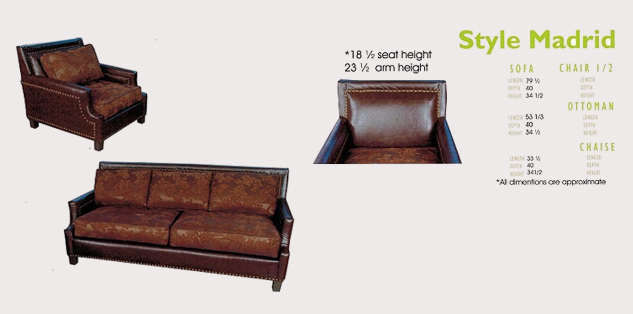
Image resolution: width=633 pixels, height=314 pixels. I want to click on brown leather back of chair, so click(401, 122).